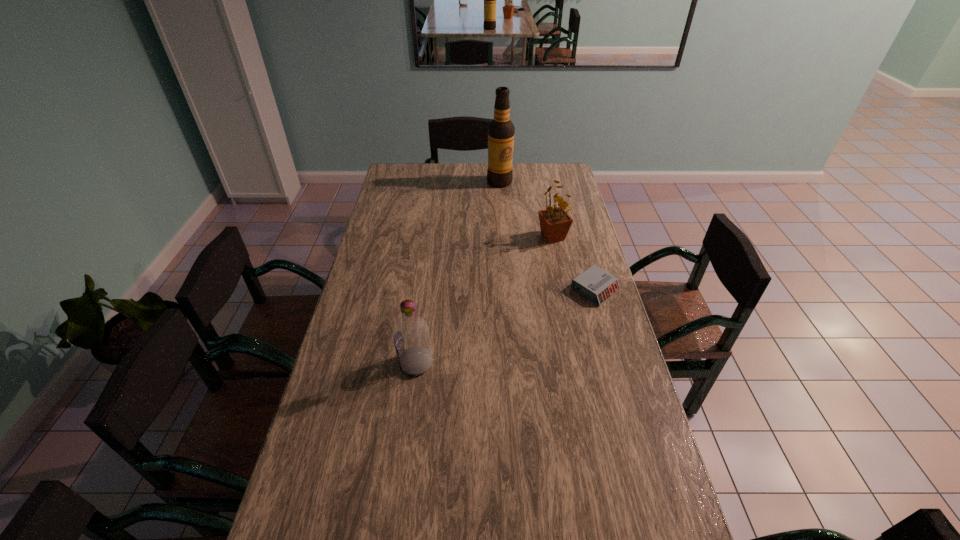
Identify the location of object that is the second closest to the sunflower. The height and width of the screenshot is (540, 960). (501, 130).

The height and width of the screenshot is (540, 960). Identify the location of object that stands as the closest to the second nearest object. (555, 222).

The width and height of the screenshot is (960, 540). Find the location of `free location that satisfies the following two spatial constraints: 1. on the front side of the alcohol; 2. on the left side of the alarm clock`. free location that satisfies the following two spatial constraints: 1. on the front side of the alcohol; 2. on the left side of the alarm clock is located at coordinates (507, 289).